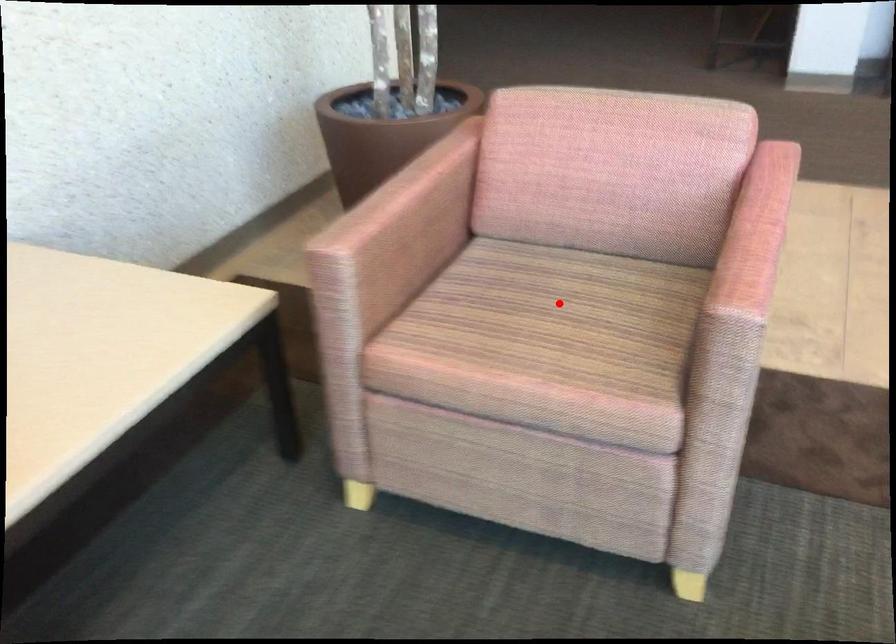
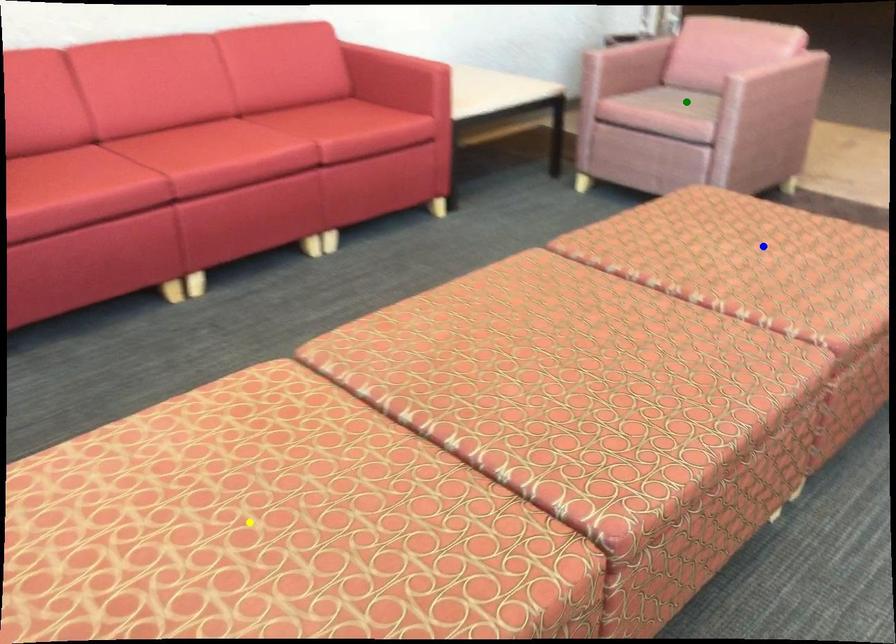
Question: I am providing you with two images of the same scene from different viewpoints. A red point is marked on the first image. You are given multiple points on the second image. Which mark in image 2 goes with the point in image 1?

Choices:
 (A) blue point
 (B) green point
 (C) yellow point

Answer: (B)